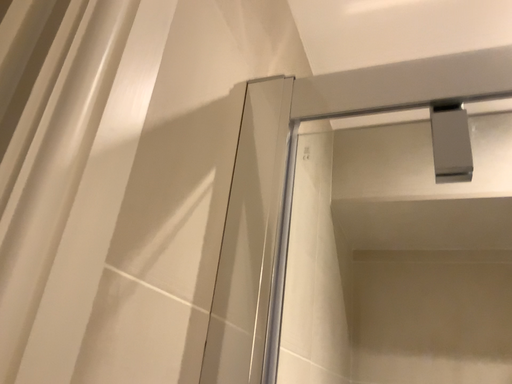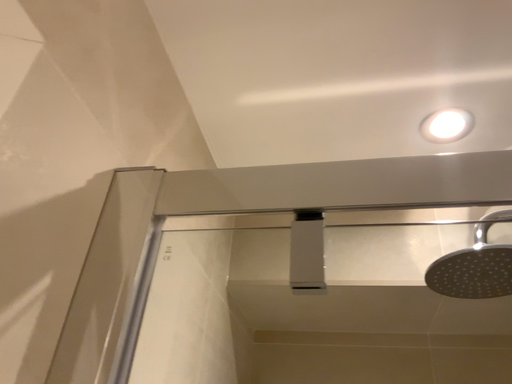
Question: Which way did the camera rotate in the video?

Choices:
 (A) rotated downward
 (B) rotated upward

Answer: (B)